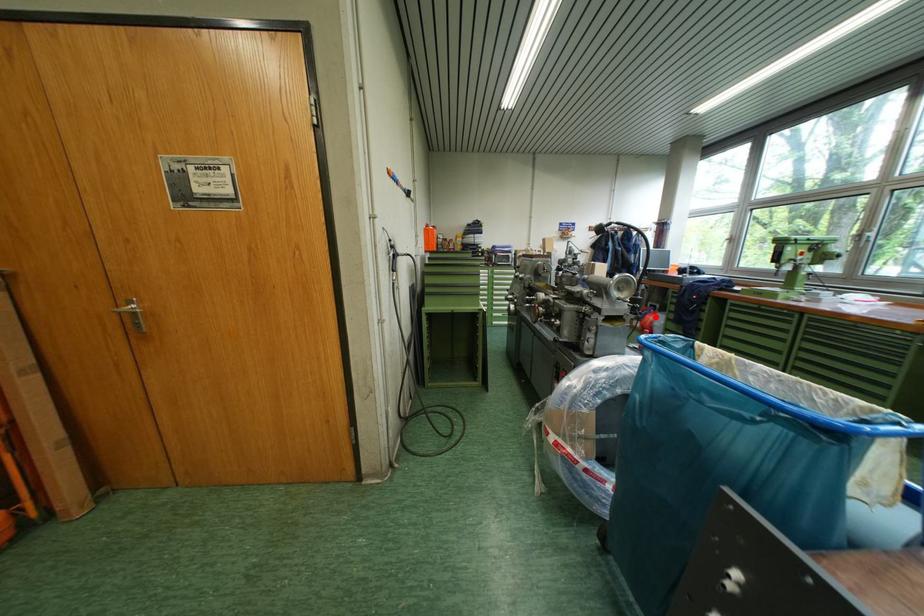
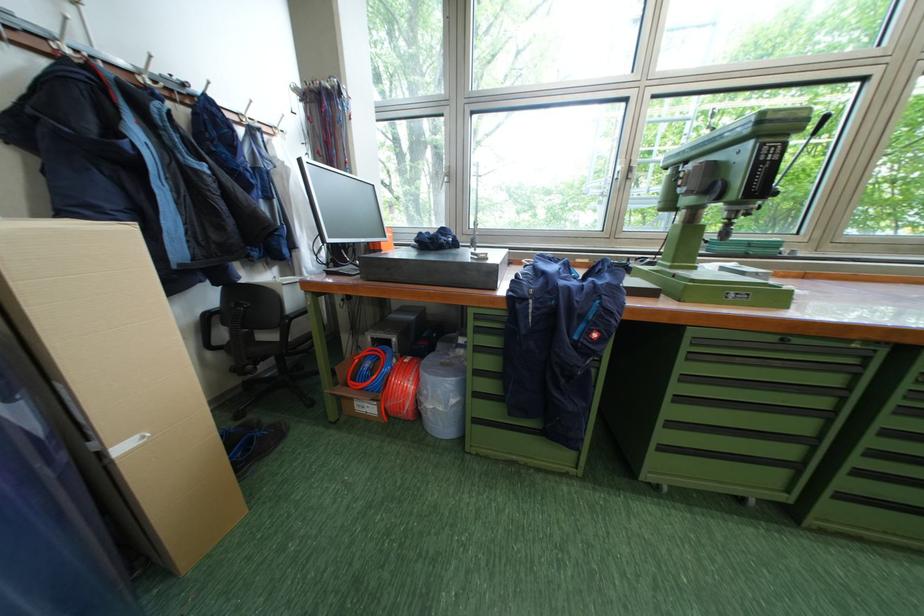
Question: I am providing you with two images of the same scene from different viewpoints. Given a red point in image1, look at the same physical point in image2. Is it:

Choices:
 (A) Closer to the viewpoint
 (B) Farther from the viewpoint

Answer: (A)